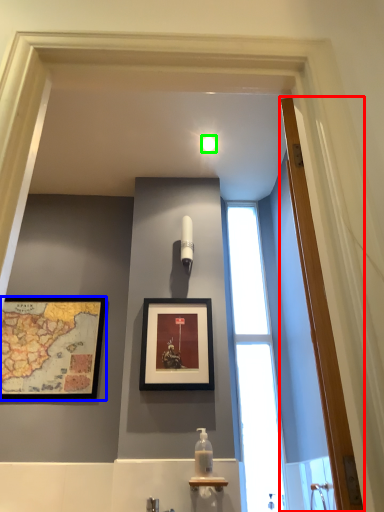
Question: Which is nearer to the door (highlighted by a red box)? picture frame (highlighted by a blue box) or light fixture (highlighted by a green box).

Choices:
 (A) picture frame
 (B) light fixture

Answer: (B)